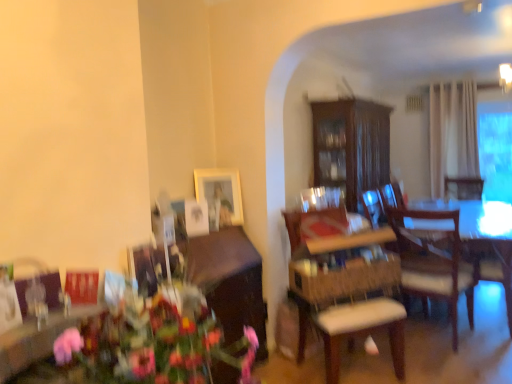
This screenshot has width=512, height=384. What do you see at coordinates (492, 265) in the screenshot? I see `wooden armchair at right` at bounding box center [492, 265].

This screenshot has width=512, height=384. Identify the location of dark wood cabinet at center, the second cabinetry positioned from the front. (351, 146).

This screenshot has width=512, height=384. Find the location of `wooden chair with white cushion at right, the first chair positioned from the bottom`. wooden chair with white cushion at right, the first chair positioned from the bottom is located at coordinates (349, 299).

What is the approximate width of matte wooden picture frame at upper center?

matte wooden picture frame at upper center is 3.68 inches in width.

The image size is (512, 384). What do you see at coordinates (226, 265) in the screenshot? I see `wooden cabinet at lower left, the second cabinetry when ordered from top to bottom` at bounding box center [226, 265].

What is the approximate height of wooden chair at center, which appears as the second chair when ordered from the bottom?

wooden chair at center, which appears as the second chair when ordered from the bottom, is 11.47 inches tall.

Where is `wooden armchair at right`? The image size is (512, 384). wooden armchair at right is located at coordinates (492, 265).

Considering the relative sizes of dark wood cabinet at center, which is counted as the first cabinetry, starting from the top, and wooden chair at center, placed as the first chair when sorted from top to bottom, in the image provided, is dark wood cabinet at center, which is counted as the first cabinetry, starting from the top, thinner than wooden chair at center, placed as the first chair when sorted from top to bottom,?

No.

From the image's perspective, is dark wood cabinet at center, arranged as the second cabinetry when viewed from the left, on wooden chair at center, which appears as the second chair when ordered from the bottom?

Correct, dark wood cabinet at center, arranged as the second cabinetry when viewed from the left, appears higher than wooden chair at center, which appears as the second chair when ordered from the bottom, in the image.

Would you say dark wood cabinet at center, the second cabinetry positioned from the front, is inside or outside wooden chair at center, which appears as the second chair when ordered from the bottom?

dark wood cabinet at center, the second cabinetry positioned from the front, is outside wooden chair at center, which appears as the second chair when ordered from the bottom.

Between transparent glass window at right and wooden chair with white cushion at right, the first chair positioned from the bottom, which one has smaller width?

transparent glass window at right.

Based on their positions, is transparent glass window at right located to the left or right of wooden chair with white cushion at right, which ranks as the 2th chair in top-to-bottom order?

From the image, it's evident that transparent glass window at right is to the right of wooden chair with white cushion at right, which ranks as the 2th chair in top-to-bottom order.

Is the surface of transparent glass window at right in direct contact with wooden chair with white cushion at right, the first chair positioned from the bottom?

They are not placed beside each other.

From the image's perspective, between transparent glass window at right and wooden chair with white cushion at right, which ranks as the 2th chair in top-to-bottom order, who is located below?

From the image's view, wooden chair with white cushion at right, which ranks as the 2th chair in top-to-bottom order, is below.

Is wooden cabinet at lower left, which is counted as the 1th cabinetry, starting from the front, smaller than wooden chair at center, which appears as the second chair when ordered from the bottom?

No, wooden cabinet at lower left, which is counted as the 1th cabinetry, starting from the front, is not smaller than wooden chair at center, which appears as the second chair when ordered from the bottom.

Image resolution: width=512 pixels, height=384 pixels. Find the location of `cabinetry in front of the wooden chair at center, which appears as the second chair when ordered from the bottom`. cabinetry in front of the wooden chair at center, which appears as the second chair when ordered from the bottom is located at coordinates (226, 265).

From the image's perspective, is wooden cabinet at lower left, the 1th cabinetry when ordered from bottom to top, on wooden chair at center, placed as the first chair when sorted from top to bottom?

No, from the image's perspective, wooden cabinet at lower left, the 1th cabinetry when ordered from bottom to top, is not above wooden chair at center, placed as the first chair when sorted from top to bottom.

Is wooden cabinet at lower left, the 1th cabinetry when ordered from bottom to top, taller than wooden chair at center, placed as the first chair when sorted from top to bottom?

Yes.

Can you confirm if wooden chair with white cushion at right, which ranks as the 2th chair in top-to-bottom order, is shorter than wooden chair at center, which appears as the second chair when ordered from the bottom?

No, wooden chair with white cushion at right, which ranks as the 2th chair in top-to-bottom order, is not shorter than wooden chair at center, which appears as the second chair when ordered from the bottom.

Considering the sizes of wooden chair with white cushion at right, which ranks as the 2th chair in top-to-bottom order, and wooden chair at center, placed as the first chair when sorted from top to bottom, in the image, is wooden chair with white cushion at right, which ranks as the 2th chair in top-to-bottom order, bigger or smaller than wooden chair at center, placed as the first chair when sorted from top to bottom,?

Considering their sizes, wooden chair with white cushion at right, which ranks as the 2th chair in top-to-bottom order, takes up more space than wooden chair at center, placed as the first chair when sorted from top to bottom.

Can you confirm if wooden chair with white cushion at right, the first chair positioned from the bottom, is positioned to the right of wooden chair at center, which appears as the second chair when ordered from the bottom?

Indeed, wooden chair with white cushion at right, the first chair positioned from the bottom, is positioned on the right side of wooden chair at center, which appears as the second chair when ordered from the bottom.

Is matte wooden picture frame at upper center located within transparent glass window at right?

No, matte wooden picture frame at upper center is not a part of transparent glass window at right.

From a real-world perspective, who is located lower, transparent glass window at right or matte wooden picture frame at upper center?

From a 3D spatial view, matte wooden picture frame at upper center is below.

Are transparent glass window at right and matte wooden picture frame at upper center located far from each other?

transparent glass window at right is positioned a significant distance from matte wooden picture frame at upper center.

From the image's perspective, does transparent glass window at right appear higher than matte wooden picture frame at upper center?

Yes, from the image's perspective, transparent glass window at right is above matte wooden picture frame at upper center.

Locate an element on the screen. window screen above the wooden armchair at right (from a real-world perspective) is located at coordinates (495, 149).

Is wooden armchair at right wider or thinner than transparent glass window at right?

Clearly, wooden armchair at right has more width compared to transparent glass window at right.

Would you say wooden armchair at right contains transparent glass window at right?

No.

Is wooden armchair at right next to transparent glass window at right and touching it?

No, wooden armchair at right is not in contact with transparent glass window at right.

From a real-world perspective, starting from the matte wooden picture frame at upper center, which chair is the 1st one below it? Please provide its 2D coordinates.

[(320, 224)]

Does point (221, 202) appear closer or farther from the camera than point (295, 226)?

Point (221, 202) is closer to the camera than point (295, 226).

Is matte wooden picture frame at upper center positioned far away from wooden chair at center, which appears as the second chair when ordered from the bottom?

No, matte wooden picture frame at upper center is in close proximity to wooden chair at center, which appears as the second chair when ordered from the bottom.

From a real-world perspective, who is located lower, matte wooden picture frame at upper center or wooden chair at center, which appears as the second chair when ordered from the bottom?

From a 3D spatial view, wooden chair at center, which appears as the second chair when ordered from the bottom, is below.

The height and width of the screenshot is (384, 512). In order to click on cabinetry on the right side of wooden chair at center, placed as the first chair when sorted from top to bottom in this screenshot , I will do `click(351, 146)`.

Identify the location of the 1st chair to the left when counting from the transparent glass window at right. The width and height of the screenshot is (512, 384). (349, 299).

Looking at the image, which one is located closer to wooden armchair at right, wooden cabinet at lower left, the 2th cabinetry in the right-to-left sequence, or wooden chair at center, which appears as the second chair when ordered from the bottom?

wooden chair at center, which appears as the second chair when ordered from the bottom, is closer to wooden armchair at right.

Which object lies nearer to the anchor point wooden cabinet at lower left, which is counted as the 1th cabinetry, starting from the front, dark wood cabinet at center, the second cabinetry positioned from the front, or transparent glass window at right?

The object closer to wooden cabinet at lower left, which is counted as the 1th cabinetry, starting from the front, is dark wood cabinet at center, the second cabinetry positioned from the front.

Considering their positions, is matte wooden picture frame at upper center positioned further to dark wood cabinet at center, the second cabinetry positioned from the front, than wooden chair with white cushion at right, which ranks as the 2th chair in top-to-bottom order?

matte wooden picture frame at upper center.

Which object lies nearer to the anchor point wooden armchair at right, wooden chair with white cushion at right, which ranks as the 2th chair in top-to-bottom order, or dark wood cabinet at center, which is counted as the first cabinetry, starting from the top?

dark wood cabinet at center, which is counted as the first cabinetry, starting from the top.

When comparing their distances from wooden chair at center, which appears as the second chair when ordered from the bottom, does matte wooden picture frame at upper center or dark wood cabinet at center, the second cabinetry positioned from the front, seem closer?

Among the two, matte wooden picture frame at upper center is located nearer to wooden chair at center, which appears as the second chair when ordered from the bottom.

Estimate the real-world distances between objects in this image. Which object is further from matte wooden picture frame at upper center, wooden armchair at right or wooden chair with white cushion at right, the first chair positioned from the bottom?

The object further to matte wooden picture frame at upper center is wooden armchair at right.

Considering their positions, is matte wooden picture frame at upper center positioned closer to dark wood cabinet at center, which ranks as the second cabinetry in bottom-to-top order, than wooden armchair at right?

Based on the image, wooden armchair at right appears to be nearer to dark wood cabinet at center, which ranks as the second cabinetry in bottom-to-top order.

From the image, which object appears to be nearer to wooden armchair at right, matte wooden picture frame at upper center or wooden chair at center, placed as the first chair when sorted from top to bottom?

wooden chair at center, placed as the first chair when sorted from top to bottom, is positioned closer to the anchor wooden armchair at right.

You are a GUI agent. You are given a task and a screenshot of the screen. Output one action in this format:
    pyautogui.click(x=<x>, y=<y>)
    Task: Click on the armchair positioned between wooden chair with white cushion at right, which ranks as the 2th chair in top-to-bottom order, and transparent glass window at right from near to far
    
    Given the screenshot: What is the action you would take?
    pyautogui.click(x=492, y=265)

Locate an element on the screen. Image resolution: width=512 pixels, height=384 pixels. armchair located between matte wooden picture frame at upper center and transparent glass window at right in the left-right direction is located at coordinates (492, 265).

I want to click on armchair located between wooden chair with white cushion at right, the first chair positioned from the bottom, and dark wood cabinet at center, the second cabinetry positioned from the front, in the depth direction, so click(492, 265).

You are a GUI agent. You are given a task and a screenshot of the screen. Output one action in this format:
    pyautogui.click(x=<x>, y=<y>)
    Task: Click on the chair between wooden chair at center, which appears as the second chair when ordered from the bottom, and wooden armchair at right from left to right
    Image resolution: width=512 pixels, height=384 pixels.
    Given the screenshot: What is the action you would take?
    pyautogui.click(x=349, y=299)